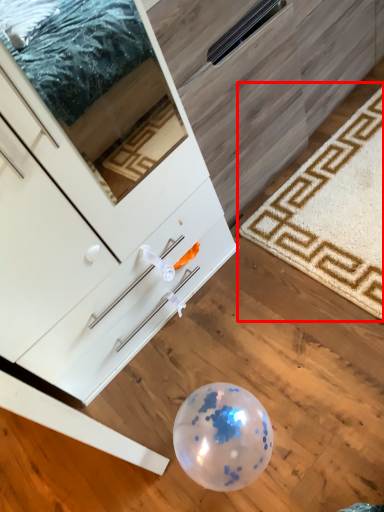
Question: From the image's perspective, what is the correct spatial positioning of mat (annotated by the red box) in reference to chest of drawers?

Choices:
 (A) below
 (B) above

Answer: (B)